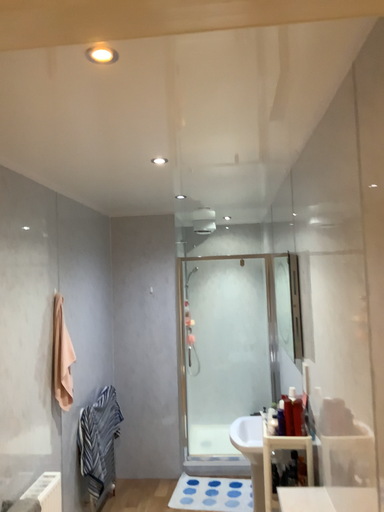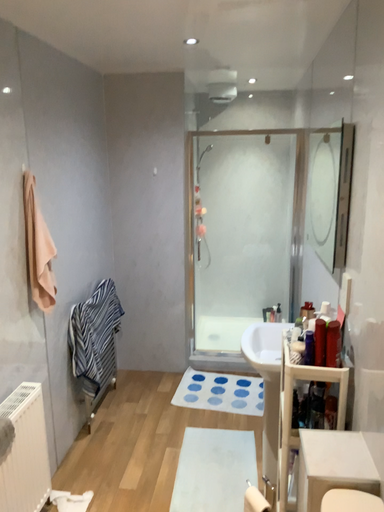
Question: How did the camera likely rotate when shooting the video?

Choices:
 (A) rotated upward
 (B) rotated downward

Answer: (B)